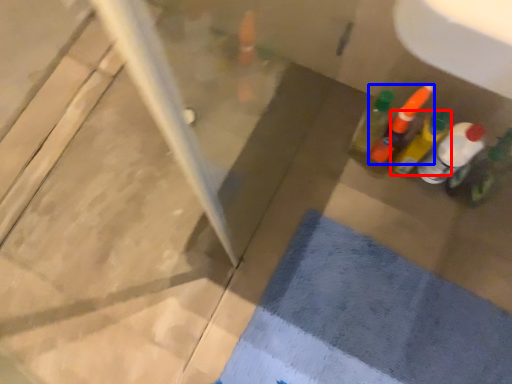
Question: Which point is further to the camera, bottle (highlighted by a red box) or bottle (highlighted by a blue box)?

Choices:
 (A) bottle
 (B) bottle

Answer: (B)